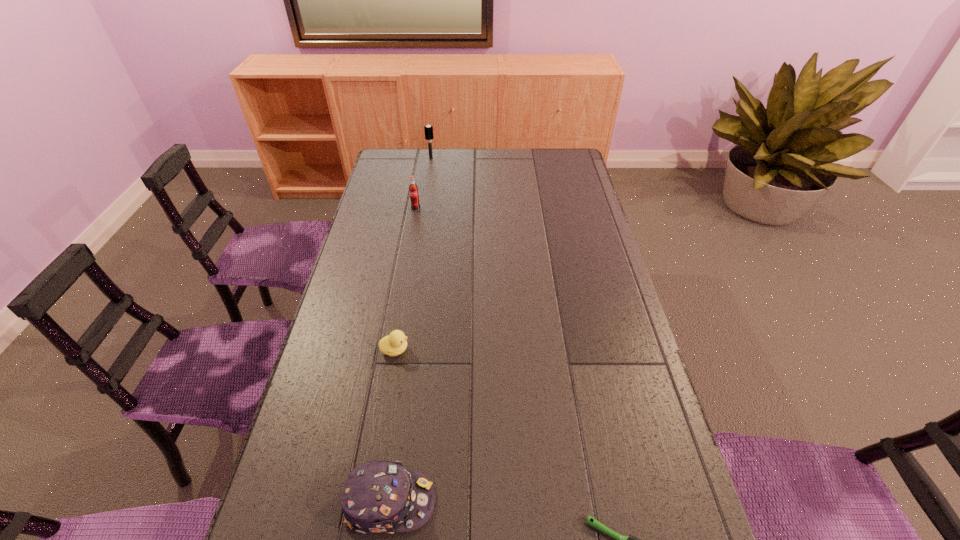
I want to click on object situated at the far edge, so click(x=428, y=129).

Find the location of a particular element. The image size is (960, 540). object located at the left edge is located at coordinates (378, 497).

The image size is (960, 540). In the image, there is a desktop. Find the location of `free space at the far edge`. free space at the far edge is located at coordinates (516, 163).

Locate an element on the screen. This screenshot has width=960, height=540. free space at the left edge is located at coordinates (369, 240).

This screenshot has width=960, height=540. In the image, there is a desktop. Find the location of `free space at the right edge`. free space at the right edge is located at coordinates (564, 198).

Where is `vacant space that's between the second farthest object and the third tallest object`? The height and width of the screenshot is (540, 960). vacant space that's between the second farthest object and the third tallest object is located at coordinates (403, 355).

Locate an element on the screen. This screenshot has height=540, width=960. vacant area that lies between the duckling and the soda bottle is located at coordinates (405, 279).

At what (x,y) coordinates should I click in order to perform the action: click on vacant region between the soda bottle and the third tallest object. Please return your answer as a coordinate pair (x, y). The height and width of the screenshot is (540, 960). Looking at the image, I should click on (403, 355).

The width and height of the screenshot is (960, 540). Identify the location of vacant area that lies between the headwear and the third nearest object. (393, 426).

Locate an element on the screen. This screenshot has width=960, height=540. vacant space that's between the fourth nearest object and the third shortest object is located at coordinates (403, 355).